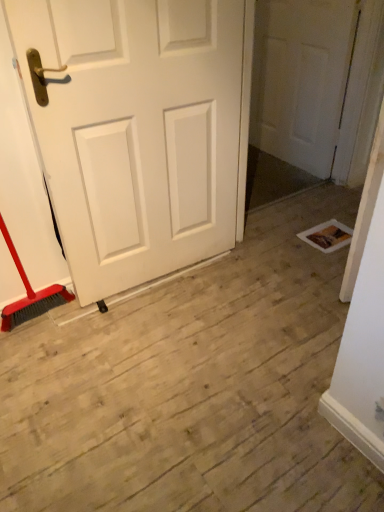
Describe the element at coordinates (301, 79) in the screenshot. Image resolution: width=384 pixels, height=512 pixels. I see `white matte door at upper right, which appears as the 2th door when viewed from the left` at that location.

I want to click on white matte door at upper right, which appears as the 2th door when viewed from the left, so click(x=301, y=79).

Describe the element at coordinates (138, 131) in the screenshot. I see `white matte door at left, which is counted as the 2th door, starting from the right` at that location.

What is the approximate height of white matte door at left, which is counted as the 2th door, starting from the right?

1.18 meters.

At what (x,y) coordinates should I click in order to perform the action: click on white matte door at left, which appears as the 1th door when viewed from the left. Please return your answer as a coordinate pair (x, y). This screenshot has height=512, width=384. Looking at the image, I should click on (138, 131).

Image resolution: width=384 pixels, height=512 pixels. In order to click on white matte door at upper right, the first door in the back-to-front sequence in this screenshot , I will do `click(301, 79)`.

Is white matte door at left, which appears as the 1th door when viewed from the left, to the right of white matte door at upper right, the first door in the back-to-front sequence, from the viewer's perspective?

No, white matte door at left, which appears as the 1th door when viewed from the left, is not to the right of white matte door at upper right, the first door in the back-to-front sequence.

Between white matte door at left, arranged as the first door when viewed from the front, and white matte door at upper right, which appears as the 2th door when viewed from the left, which one is positioned in front?

white matte door at left, arranged as the first door when viewed from the front.

Is point (157, 34) closer to camera compared to point (291, 38)?

Yes, it is.

From the image's perspective, would you say white matte door at left, marked as the second door in a back-to-front arrangement, is shown under white matte door at upper right, which appears as the 2th door when viewed from the left?

Indeed, from the image's perspective, white matte door at left, marked as the second door in a back-to-front arrangement, is shown beneath white matte door at upper right, which appears as the 2th door when viewed from the left.

From a real-world perspective, is white matte door at left, which appears as the 1th door when viewed from the left, physically below white matte door at upper right, the 2th door positioned from the front?

No, from a real-world perspective, white matte door at left, which appears as the 1th door when viewed from the left, is not under white matte door at upper right, the 2th door positioned from the front.

Between white matte door at left, which appears as the 1th door when viewed from the left, and white matte door at upper right, which appears as the 2th door when viewed from the left, which one has smaller width?

white matte door at upper right, which appears as the 2th door when viewed from the left.

Is white matte door at left, marked as the second door in a back-to-front arrangement, shorter than white matte door at upper right, which appears as the 2th door when viewed from the left?

No.

Can you confirm if white matte door at left, which appears as the 1th door when viewed from the left, is smaller than white matte door at upper right, the 1th door viewed from the right?

Actually, white matte door at left, which appears as the 1th door when viewed from the left, might be larger than white matte door at upper right, the 1th door viewed from the right.

Choose the correct answer: Is white matte door at left, which appears as the 1th door when viewed from the left, inside white matte door at upper right, the first door in the back-to-front sequence, or outside it?

white matte door at left, which appears as the 1th door when viewed from the left, is not inside white matte door at upper right, the first door in the back-to-front sequence, it's outside.

Does white matte door at left, which is counted as the 2th door, starting from the right, touch white matte door at upper right, the 1th door viewed from the right?

white matte door at left, which is counted as the 2th door, starting from the right, and white matte door at upper right, the 1th door viewed from the right, are not in contact.

Is white matte door at left, arranged as the first door when viewed from the front, aimed at white matte door at upper right, the 1th door viewed from the right?

No, white matte door at left, arranged as the first door when viewed from the front, is not aimed at white matte door at upper right, the 1th door viewed from the right.

Can you tell me how much white matte door at left, marked as the second door in a back-to-front arrangement, and white matte door at upper right, which appears as the 2th door when viewed from the left, differ in facing direction?

The angular difference between white matte door at left, marked as the second door in a back-to-front arrangement, and white matte door at upper right, which appears as the 2th door when viewed from the left, is 90.2 degrees.

How much distance is there between white matte door at left, which appears as the 1th door when viewed from the left, and white matte door at upper right, the 1th door viewed from the right?

The distance of white matte door at left, which appears as the 1th door when viewed from the left, from white matte door at upper right, the 1th door viewed from the right, is 1.26 meters.

Where is `door on the left of white matte door at upper right, the first door in the back-to-front sequence`? This screenshot has width=384, height=512. door on the left of white matte door at upper right, the first door in the back-to-front sequence is located at coordinates (138, 131).

Which object is positioned more to the left, white matte door at upper right, the first door in the back-to-front sequence, or white matte door at left, arranged as the first door when viewed from the front?

white matte door at left, arranged as the first door when viewed from the front.

Is white matte door at upper right, the 1th door viewed from the right, closer to the viewer compared to white matte door at left, which is counted as the 2th door, starting from the right?

No, it is behind white matte door at left, which is counted as the 2th door, starting from the right.

Does point (288, 126) come behind point (211, 82)?

That is True.

From the image's perspective, is white matte door at upper right, the 1th door viewed from the right, below white matte door at left, which appears as the 1th door when viewed from the left?

Incorrect, from the image's perspective, white matte door at upper right, the 1th door viewed from the right, is higher than white matte door at left, which appears as the 1th door when viewed from the left.

From a real-world perspective, between white matte door at upper right, the first door in the back-to-front sequence, and white matte door at left, marked as the second door in a back-to-front arrangement, who is vertically lower?

From a 3D spatial view, white matte door at upper right, the first door in the back-to-front sequence, is below.

Considering the sizes of objects white matte door at upper right, the 1th door viewed from the right, and white matte door at left, which appears as the 1th door when viewed from the left, in the image provided, who is thinner, white matte door at upper right, the 1th door viewed from the right, or white matte door at left, which appears as the 1th door when viewed from the left,?

With smaller width is white matte door at upper right, the 1th door viewed from the right.

Considering the sizes of objects white matte door at upper right, the 2th door positioned from the front, and white matte door at left, marked as the second door in a back-to-front arrangement, in the image provided, who is shorter, white matte door at upper right, the 2th door positioned from the front, or white matte door at left, marked as the second door in a back-to-front arrangement,?

Answer: white matte door at upper right, the 2th door positioned from the front.

Is white matte door at upper right, the first door in the back-to-front sequence, bigger or smaller than white matte door at left, marked as the second door in a back-to-front arrangement?

In the image, white matte door at upper right, the first door in the back-to-front sequence, appears to be smaller than white matte door at left, marked as the second door in a back-to-front arrangement.

Is white matte door at upper right, the 2th door positioned from the front, located outside white matte door at left, which is counted as the 2th door, starting from the right?

white matte door at upper right, the 2th door positioned from the front, is positioned outside white matte door at left, which is counted as the 2th door, starting from the right.

Is there a large distance between white matte door at upper right, the 2th door positioned from the front, and white matte door at left, marked as the second door in a back-to-front arrangement?

Yes, white matte door at upper right, the 2th door positioned from the front, and white matte door at left, marked as the second door in a back-to-front arrangement, are quite far apart.

Could you tell me if white matte door at upper right, the 1th door viewed from the right, is facing white matte door at left, marked as the second door in a back-to-front arrangement?

Yes, white matte door at upper right, the 1th door viewed from the right, is oriented towards white matte door at left, marked as the second door in a back-to-front arrangement.

How many degrees apart are the facing directions of white matte door at upper right, the 2th door positioned from the front, and white matte door at left, marked as the second door in a back-to-front arrangement?

white matte door at upper right, the 2th door positioned from the front, and white matte door at left, marked as the second door in a back-to-front arrangement, are facing 90.2 degrees away from each other.

What are the coordinates of `door that is under the white matte door at left, arranged as the first door when viewed from the front (from a real-world perspective)` in the screenshot? It's located at (301, 79).

This screenshot has height=512, width=384. What are the coordinates of `door above the white matte door at upper right, the 2th door positioned from the front (from a real-world perspective)` in the screenshot? It's located at (138, 131).

Identify the location of door located on the left of white matte door at upper right, which appears as the 2th door when viewed from the left. (138, 131).